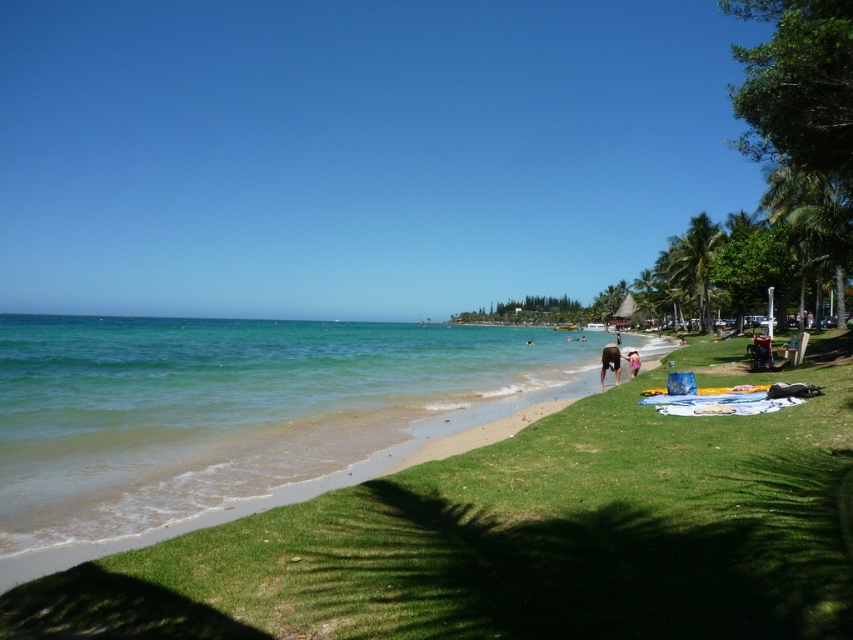
Question: Can you confirm if green sand at lower left is smaller than dark brown hair at lower center?

Choices:
 (A) yes
 (B) no

Answer: (B)

Question: Which object is closer to the camera taking this photo?

Choices:
 (A) green leafy palm tree at right
 (B) green leafy palm tree at upper right
 (C) green sand at lower left

Answer: (C)

Question: Which of these objects is positioned closest to the green sand at lower left?

Choices:
 (A) dark brown hair at lower center
 (B) pink fabric at lower right

Answer: (A)

Question: Is green leafy palm tree at upper right positioned behind dark brown hair at lower center?

Choices:
 (A) no
 (B) yes

Answer: (A)

Question: Estimate the real-world distances between objects in this image. Which object is farther from the green leafy palm tree at upper right?

Choices:
 (A) pink fabric at lower right
 (B) green leafy palm tree at right
 (C) dark brown hair at lower center

Answer: (B)

Question: Can you confirm if green leafy palm tree at upper right is positioned above pink fabric at lower right?

Choices:
 (A) no
 (B) yes

Answer: (B)